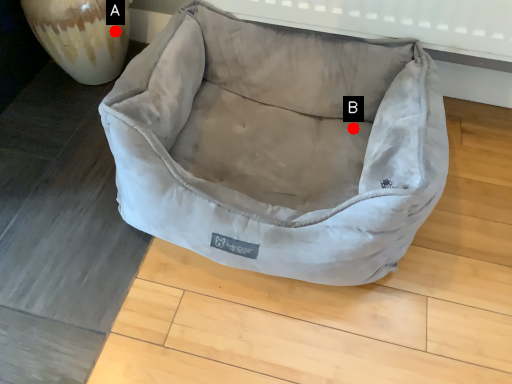
Question: Two points are circled on the image, labeled by A and B beside each circle. Which point appears farthest from the camera in this image?

Choices:
 (A) A is further
 (B) B is further

Answer: (A)